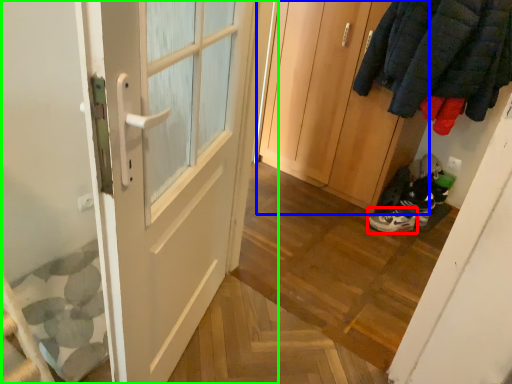
Question: Which object is positioned closest to footwear (highlighted by a red box)? Select from door (highlighted by a blue box) and door (highlighted by a green box).

Choices:
 (A) door
 (B) door

Answer: (A)